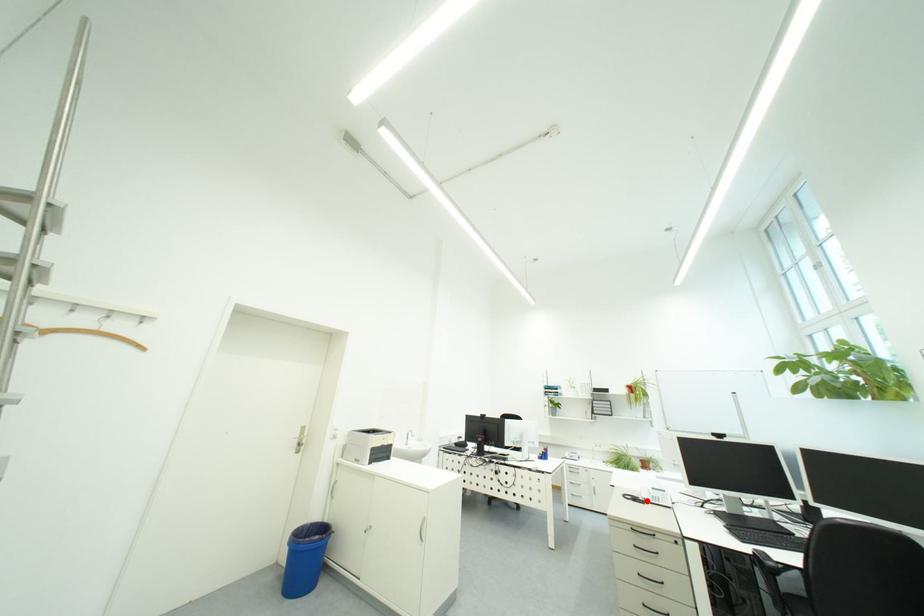
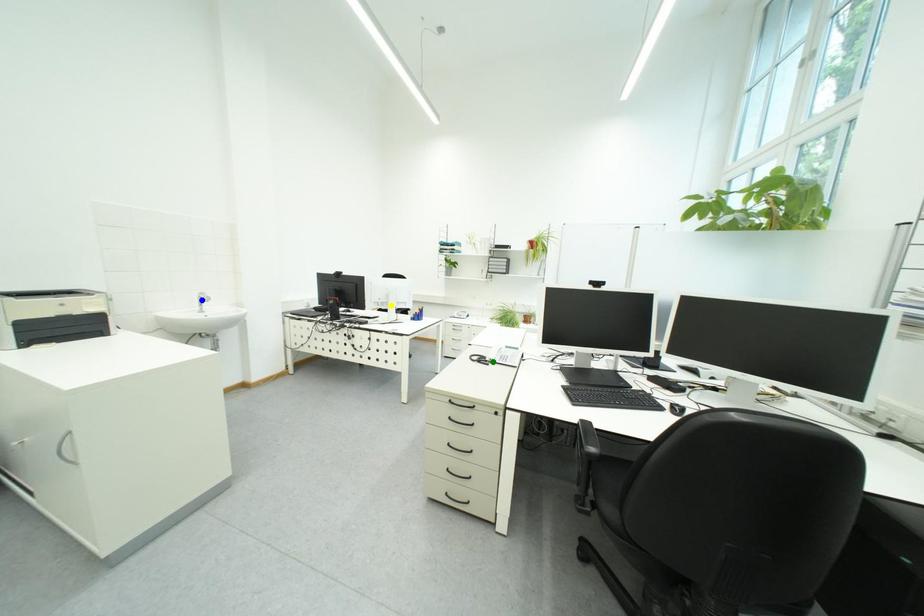
Question: I am providing you with two images of the same scene from different viewpoints. A red point is marked on the first image. You are given multiple points on the second image. Which point in image 2 represents the same 3d spot as the red point in image 1?

Choices:
 (A) green point
 (B) yellow point
 (C) blue point

Answer: (A)